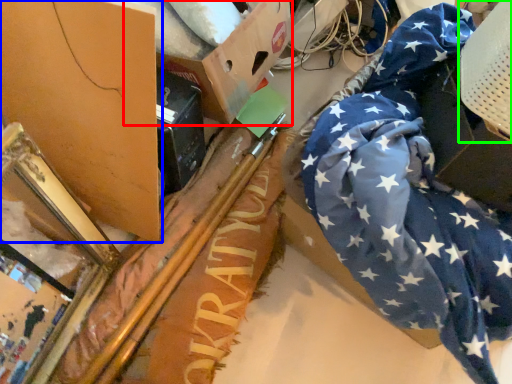
Question: Which is nearer to the cardboard box (highlighted by a red box)? cardboard box (highlighted by a blue box) or swivel chair (highlighted by a green box).

Choices:
 (A) cardboard box
 (B) swivel chair

Answer: (A)